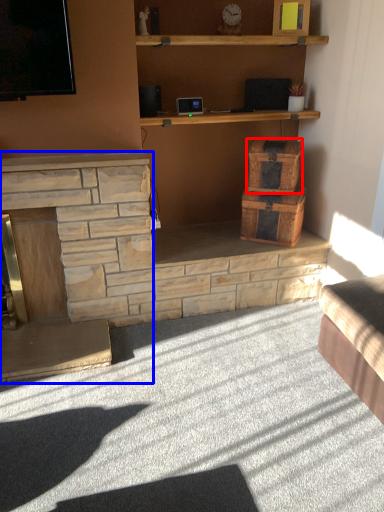
Question: Which object appears closest to the camera in this image, crate (highlighted by a red box) or fireplace (highlighted by a blue box)?

Choices:
 (A) crate
 (B) fireplace

Answer: (B)